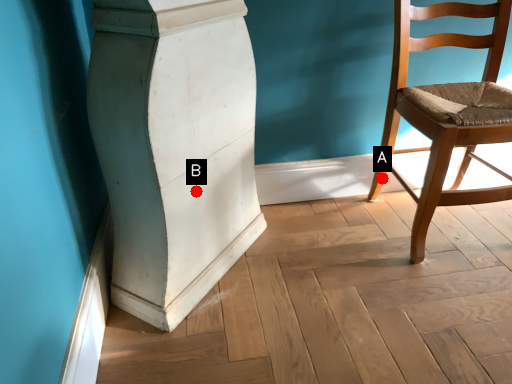
Question: Two points are circled on the image, labeled by A and B beside each circle. Among these points, which one is nearest to the camera?

Choices:
 (A) A is closer
 (B) B is closer

Answer: (B)